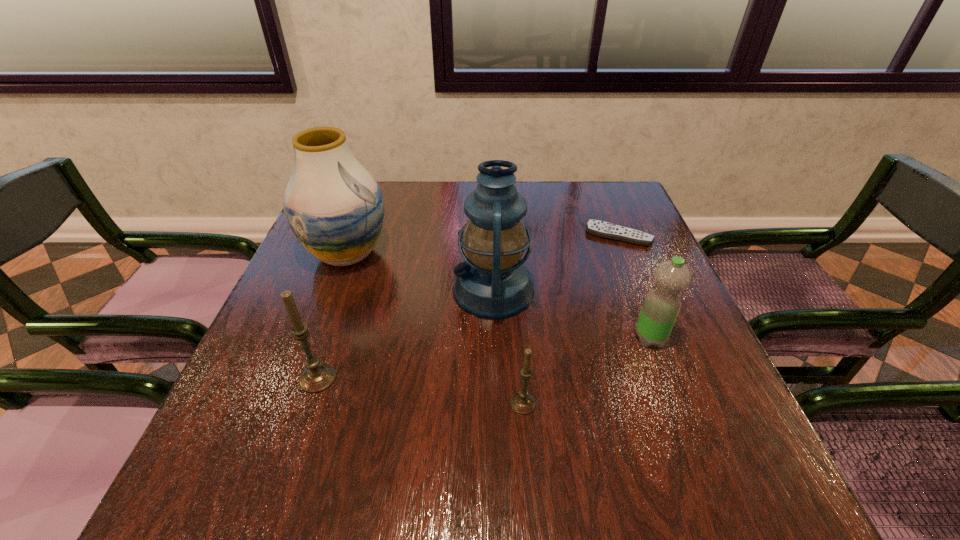
Locate an element on the screen. the left candle is located at coordinates (317, 377).

The width and height of the screenshot is (960, 540). Find the location of `the shorter candle`. the shorter candle is located at coordinates (523, 403).

Identify the location of the right candle. (523, 403).

The height and width of the screenshot is (540, 960). Identify the location of vase. (334, 207).

Where is `remote control`? remote control is located at coordinates (603, 229).

I want to click on lantern, so click(x=493, y=283).

Locate an element on the screen. The image size is (960, 540). water bottle is located at coordinates (660, 309).

Image resolution: width=960 pixels, height=540 pixels. In order to click on free location located 0.070m on the front of the taller candle in this screenshot , I will do `click(301, 428)`.

The image size is (960, 540). I want to click on free space located on the back of the fifth tallest object, so 519,367.

Identify the location of vacant space located on the back of the vase. This screenshot has width=960, height=540. (366, 204).